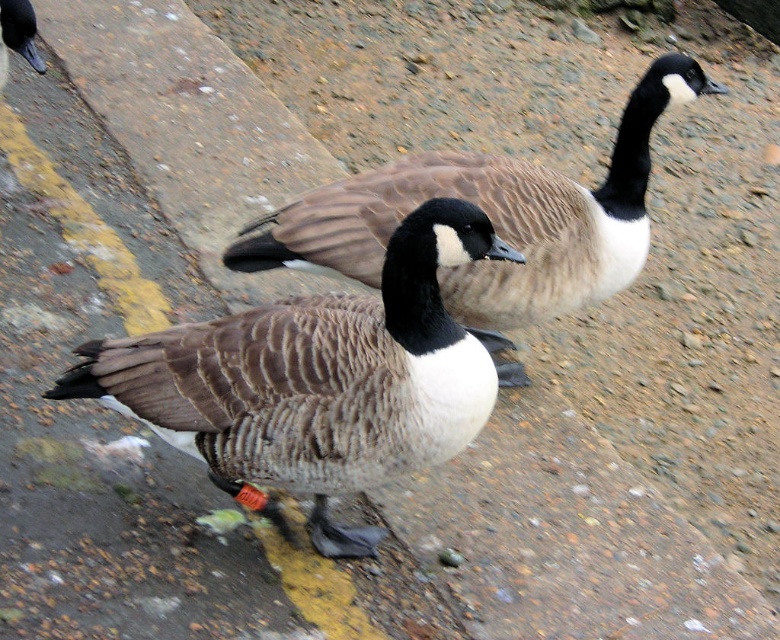
Can you confirm if brown textured duck at center is positioned to the left of brown textured goose at center?

Correct, you'll find brown textured duck at center to the left of brown textured goose at center.

Can you confirm if brown textured duck at center is thinner than brown textured goose at center?

Yes.

Who is more distant from viewer, [438,461] or [293,248]?

Point [293,248]

You are a GUI agent. You are given a task and a screenshot of the screen. Output one action in this format:
    pyautogui.click(x=<x>, y=<y>)
    Task: Click on the brown textured duck at center
    This screenshot has width=780, height=640.
    Given the screenshot: What is the action you would take?
    pyautogui.click(x=316, y=380)

Is brown textured goose at center thinner than brown feathered duck at upper left?

In fact, brown textured goose at center might be wider than brown feathered duck at upper left.

Between brown textured goose at center and brown feathered duck at upper left, which one has more height?

brown textured goose at center

The height and width of the screenshot is (640, 780). Describe the element at coordinates (491, 220) in the screenshot. I see `brown textured goose at center` at that location.

At what (x,y) coordinates should I click in order to perform the action: click on brown textured goose at center. Please return your answer as a coordinate pair (x, y). Looking at the image, I should click on (491, 220).

Which of these two, brown textured duck at center or brown feathered duck at upper left, stands taller?

With more height is brown textured duck at center.

Between brown textured duck at center and brown feathered duck at upper left, which one appears on the left side from the viewer's perspective?

Positioned to the left is brown feathered duck at upper left.

Between point (227, 380) and point (30, 60), which one is positioned behind?

The point (30, 60) is more distant.

Locate an element on the screen. brown textured duck at center is located at coordinates (316, 380).